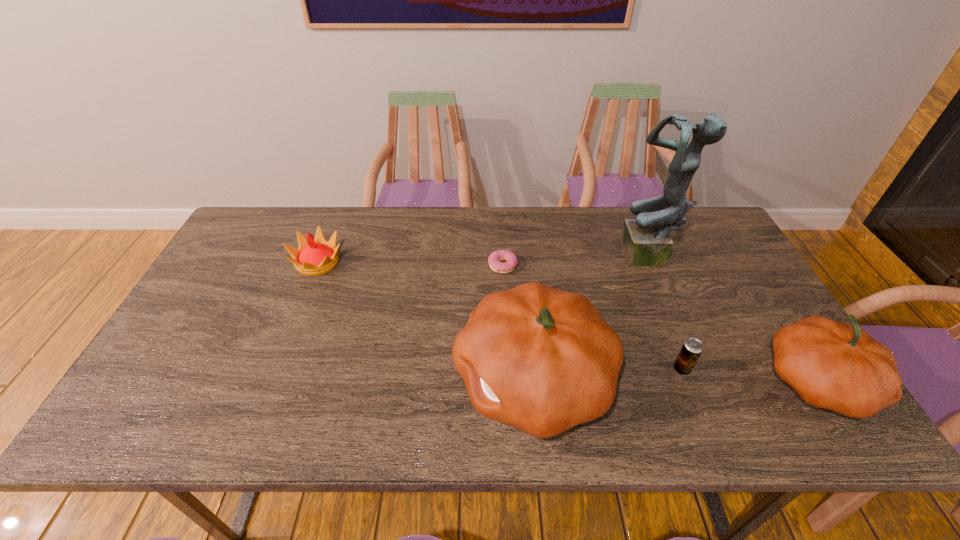
Locate an element on the screen. The height and width of the screenshot is (540, 960). free location located on the front face of the left pumpkin is located at coordinates (356, 380).

Locate an element on the screen. This screenshot has height=540, width=960. vacant position located 0.330m on the front face of the left pumpkin is located at coordinates (314, 380).

Find the location of a particular element. The width and height of the screenshot is (960, 540). vacant space located on the face of the tallest object is located at coordinates (543, 257).

Locate an element on the screen. This screenshot has width=960, height=540. vacant space situated on the face of the tallest object is located at coordinates (524, 257).

Where is `vacant space situated 0.310m on the face of the tallest object`? The height and width of the screenshot is (540, 960). vacant space situated 0.310m on the face of the tallest object is located at coordinates (520, 257).

Identify the location of blank space located 0.320m on the right of the leftmost object. The width and height of the screenshot is (960, 540). (451, 262).

Find the location of a particular element. This screenshot has height=540, width=960. blank space located on the left of the doughnut is located at coordinates (465, 266).

Identify the location of vacant area located 0.220m on the left of the fifth tallest object. The height and width of the screenshot is (540, 960). (582, 369).

Find the location of `sculpture present at the far edge`. sculpture present at the far edge is located at coordinates (645, 241).

Locate an element on the screen. This screenshot has height=540, width=960. crown that is positioned at the far edge is located at coordinates [315, 256].